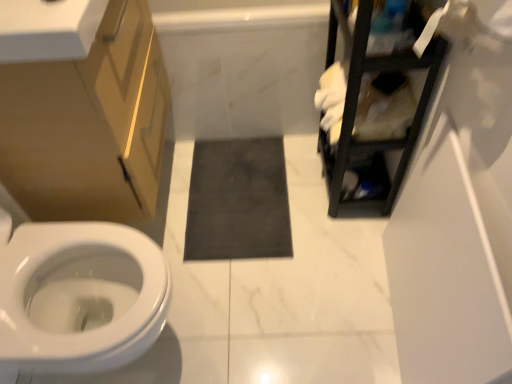
Question: Are white marble bath at center and dark gray matte bath mat at center located far from each other?

Choices:
 (A) no
 (B) yes

Answer: (A)

Question: From the image's perspective, is white marble bath at center over dark gray matte bath mat at center?

Choices:
 (A) yes
 (B) no

Answer: (A)

Question: Considering the relative sizes of white marble bath at center and dark gray matte bath mat at center in the image provided, is white marble bath at center bigger than dark gray matte bath mat at center?

Choices:
 (A) no
 (B) yes

Answer: (B)

Question: Is white marble bath at center taller than dark gray matte bath mat at center?

Choices:
 (A) no
 (B) yes

Answer: (B)

Question: From a real-world perspective, is white marble bath at center below dark gray matte bath mat at center?

Choices:
 (A) yes
 (B) no

Answer: (B)

Question: In terms of size, does white glossy countertop at upper left appear bigger or smaller than matte gold cabinet at left?

Choices:
 (A) small
 (B) big

Answer: (A)

Question: Would you say white glossy countertop at upper left is inside or outside matte gold cabinet at left?

Choices:
 (A) inside
 (B) outside

Answer: (B)

Question: Considering the relative positions of white glossy countertop at upper left and matte gold cabinet at left in the image provided, is white glossy countertop at upper left to the left or to the right of matte gold cabinet at left?

Choices:
 (A) right
 (B) left

Answer: (A)

Question: In terms of height, does white glossy countertop at upper left look taller or shorter compared to matte gold cabinet at left?

Choices:
 (A) tall
 (B) short

Answer: (B)

Question: Considering the positions of matte gold cabinet at left and white glossy countertop at upper left in the image, is matte gold cabinet at left taller or shorter than white glossy countertop at upper left?

Choices:
 (A) short
 (B) tall

Answer: (B)

Question: Is point (152, 140) closer or farther from the camera than point (31, 39)?

Choices:
 (A) farther
 (B) closer

Answer: (A)

Question: From a real-world perspective, is matte gold cabinet at left physically located above or below white glossy countertop at upper left?

Choices:
 (A) above
 (B) below

Answer: (B)

Question: From the image's perspective, is matte gold cabinet at left located above or below white glossy countertop at upper left?

Choices:
 (A) above
 (B) below

Answer: (B)

Question: Is point (65, 29) closer or farther from the camera than point (356, 160)?

Choices:
 (A) closer
 (B) farther

Answer: (A)

Question: Considering the positions of white glossy countertop at upper left and black metal shelving unit at upper right in the image, is white glossy countertop at upper left bigger or smaller than black metal shelving unit at upper right?

Choices:
 (A) big
 (B) small

Answer: (B)